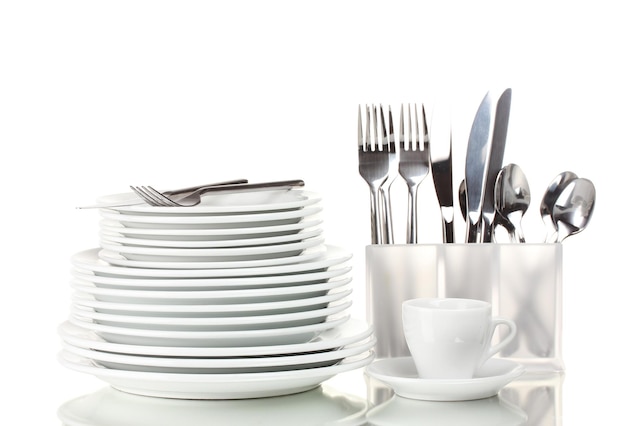
This screenshot has width=626, height=426. I want to click on spoons, so click(458, 190), click(520, 190), click(550, 192), click(572, 204).